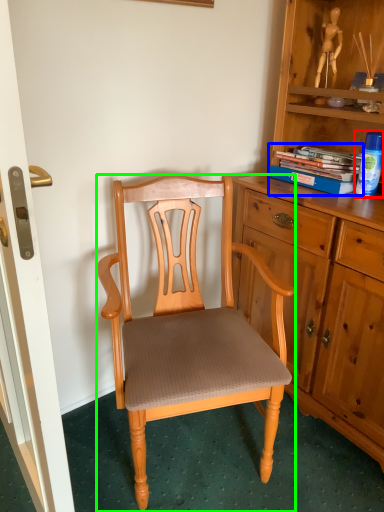
Question: Based on their relative distances, which object is nearer to toy (highlighted by a red box)? Choose from book (highlighted by a blue box) and chair (highlighted by a green box).

Choices:
 (A) book
 (B) chair

Answer: (A)